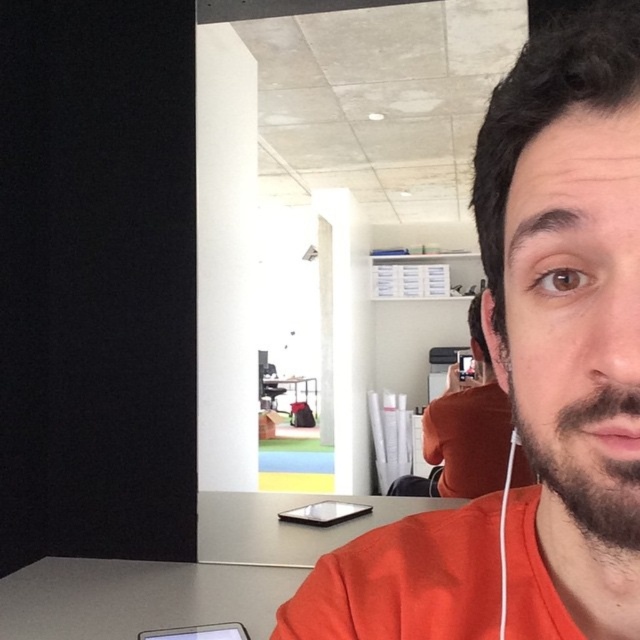
Question: Among these points, which one is nearest to the camera?

Choices:
 (A) (276, 403)
 (B) (548, 486)

Answer: (B)

Question: Where is brownbeard at right located in relation to matte black table at center in the image?

Choices:
 (A) right
 (B) left

Answer: (A)

Question: Among these objects, which one is nearest to the camera?

Choices:
 (A) orange matte shirt at right
 (B) brownbeard at right
 (C) matte black table at center
 (D) smooth gray table at center

Answer: (B)

Question: Which point is farther to the camera?

Choices:
 (A) (346, 609)
 (B) (305, 396)

Answer: (B)

Question: Does brownbeard at right appear on the right side of matte black table at center?

Choices:
 (A) no
 (B) yes

Answer: (B)

Question: Is gray matte table at lower left to the right of orange matte shirt at right from the viewer's perspective?

Choices:
 (A) no
 (B) yes

Answer: (A)